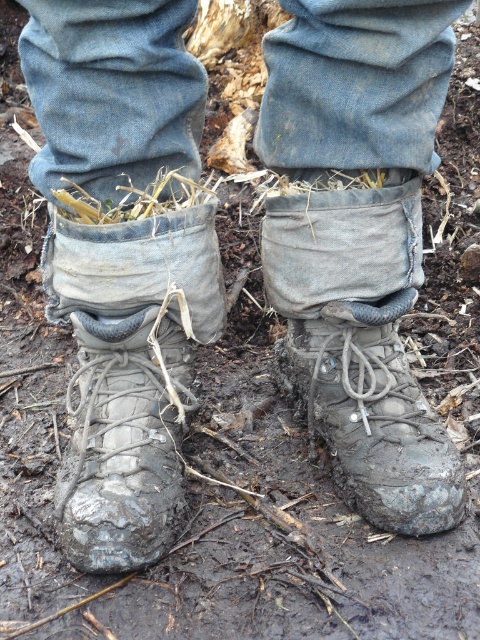
Question: Does denim at center appear on the right side of brown straw at center?

Choices:
 (A) yes
 (B) no

Answer: (A)

Question: Is denim at center thinner than muddy rubber boot at lower left?

Choices:
 (A) no
 (B) yes

Answer: (A)

Question: Estimate the real-world distances between objects in this image. Which object is closer to the muddy rubber boot at center?

Choices:
 (A) brown straw at center
 (B) denim at center
 (C) muddy rubber boot at lower left

Answer: (C)

Question: Which of the following is the closest to the observer?

Choices:
 (A) muddy rubber boot at lower left
 (B) brown straw at center
 (C) muddy rubber boot at center

Answer: (A)

Question: From the image, what is the correct spatial relationship of muddy rubber boot at center in relation to brown straw at center?

Choices:
 (A) below
 (B) above

Answer: (A)

Question: Which object is farther from the camera taking this photo?

Choices:
 (A) muddy rubber boot at center
 (B) brown straw at center
 (C) denim at center

Answer: (A)